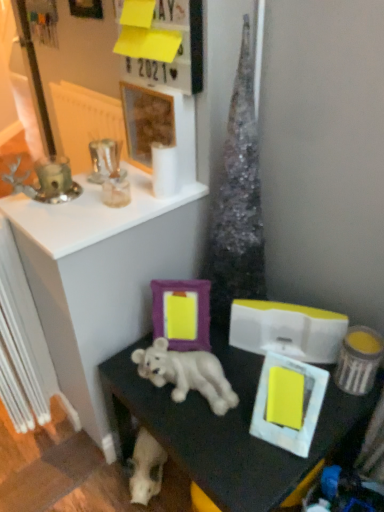
Question: Considering the positions of wooden frame at upper center, which appears as the third picture frame when viewed from the right, and yellow paper at upper center in the image, is wooden frame at upper center, which appears as the third picture frame when viewed from the right, taller or shorter than yellow paper at upper center?

Choices:
 (A) short
 (B) tall

Answer: (B)

Question: In terms of width, does wooden frame at upper center, acting as the 3th picture frame starting from the back, look wider or thinner when compared to yellow paper at upper center?

Choices:
 (A) thin
 (B) wide

Answer: (A)

Question: Which of these objects is positioned farthest from the metallic silver picture frame at upper left, which is the 4th picture frame in front-to-back order?

Choices:
 (A) white plastic radiator at left
 (B) silver metallic candle holder at upper left
 (C) yellow paper at upper center
 (D) wooden frame at upper center, the 2th picture frame positioned from the front
 (E) white matte picture frame at lower right, marked as the 4th picture frame in a left-to-right arrangement

Answer: (E)

Question: Considering the real-world distances, which object is farthest from the yellow matte box at lower right?

Choices:
 (A) purple matte picture frame at center, which is the third picture frame in front-to-back order
 (B) white matte picture frame at lower right, marked as the 4th picture frame in a left-to-right arrangement
 (C) wooden frame at upper center, the second picture frame when ordered from left to right
 (D) white plastic radiator at left
 (E) silver metallic candle holder at upper left

Answer: (D)